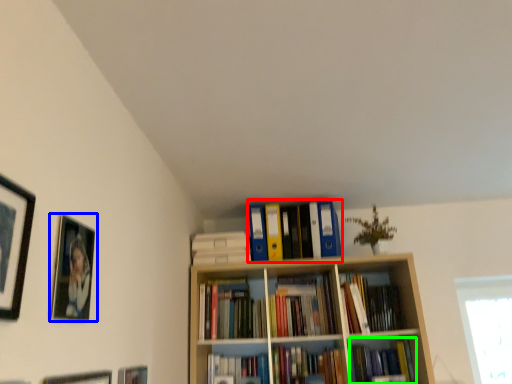
Question: Which is nearer to the book (highlighted by a red box)? picture frame (highlighted by a blue box) or book (highlighted by a green box).

Choices:
 (A) picture frame
 (B) book

Answer: (B)